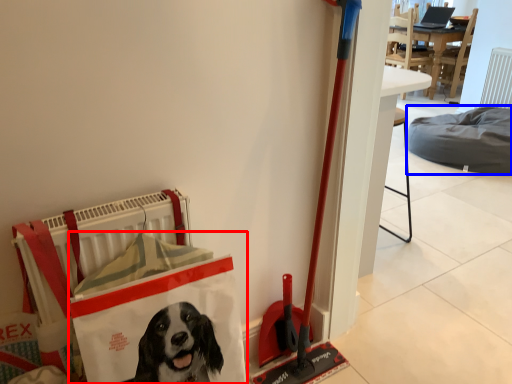
Question: Which object is closer to the camera taking this photo, shopping bag (highlighted by a red box) or dog bed (highlighted by a blue box)?

Choices:
 (A) shopping bag
 (B) dog bed

Answer: (A)